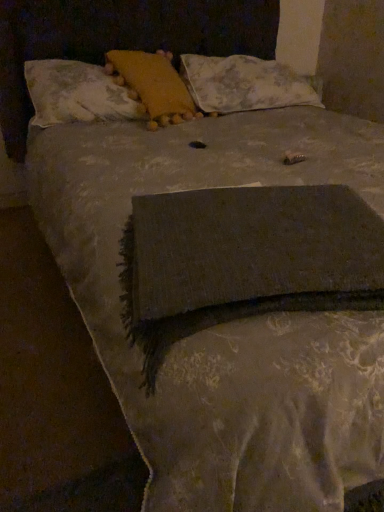
Question: In terms of width, does yellow fabric pillow at upper center, the second pillow viewed from the left, look wider or thinner when compared to floral fabric pillow at upper center, which appears as the 3th pillow when viewed from the left?

Choices:
 (A) thin
 (B) wide

Answer: (A)

Question: Relative to floral fabric pillow at upper center, placed as the 1th pillow when sorted from right to left, is yellow fabric pillow at upper center, the second pillow viewed from the left, in front or behind?

Choices:
 (A) behind
 (B) front

Answer: (B)

Question: Estimate the real-world distances between objects in this image. Which object is closer to the yellow fabric pillow at upper center, the second pillow viewed from the left?

Choices:
 (A) fluffy white pillow at upper center, acting as the first pillow starting from the left
 (B) floral fabric pillow at upper center, placed as the 1th pillow when sorted from right to left

Answer: (A)

Question: Estimate the real-world distances between objects in this image. Which object is closer to the yellow fabric pillow at upper center, the second pillow in the right-to-left sequence?

Choices:
 (A) floral fabric pillow at upper center, which appears as the 3th pillow when viewed from the left
 (B) fluffy white pillow at upper center, acting as the 3th pillow starting from the right

Answer: (B)